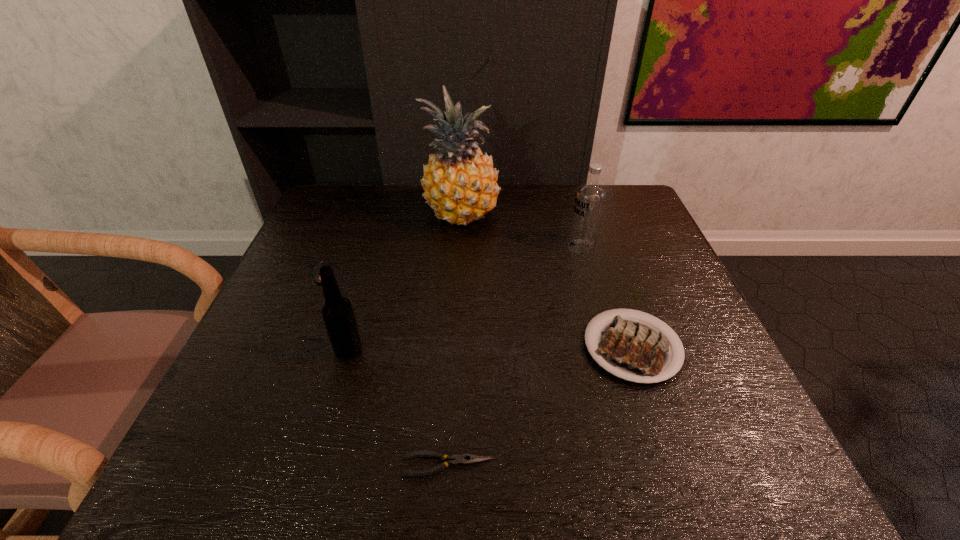
The height and width of the screenshot is (540, 960). Find the location of `free spot that satisfies the following two spatial constraints: 1. on the back side of the shortest object; 2. on the left side of the plate`. free spot that satisfies the following two spatial constraints: 1. on the back side of the shortest object; 2. on the left side of the plate is located at coordinates (454, 347).